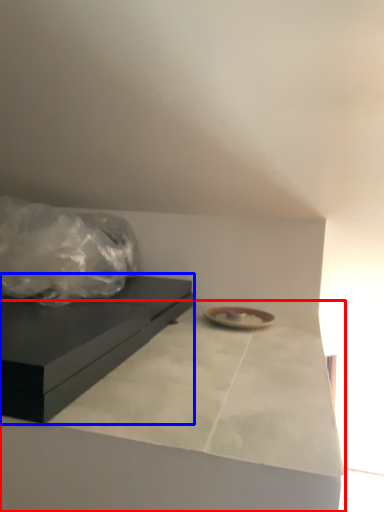
Question: Which point is closer to the camera, counter top (highlighted by a red box) or table (highlighted by a blue box)?

Choices:
 (A) counter top
 (B) table

Answer: (A)